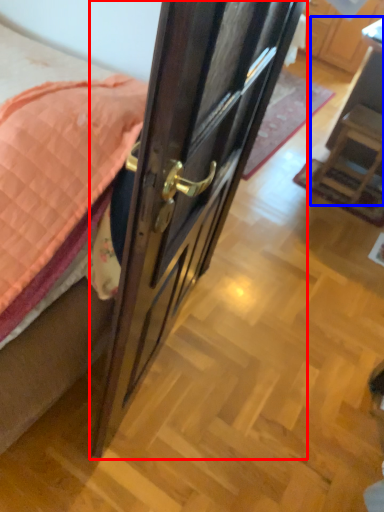
Question: Which of the following is the farthest to the observer, door (highlighted by a red box) or furniture (highlighted by a blue box)?

Choices:
 (A) door
 (B) furniture

Answer: (B)